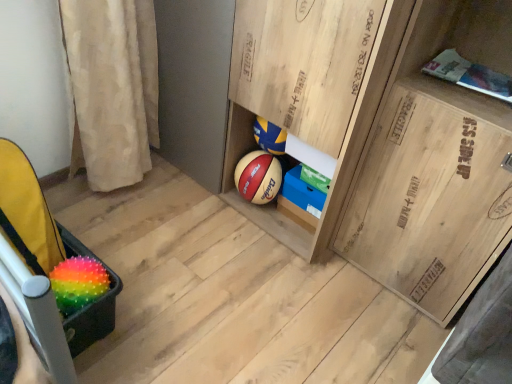
Question: Considering their positions, is rainbow spiky ball at lower left located in front of or behind blue cardboard box at center, acting as the second cabinetry starting from the left?

Choices:
 (A) behind
 (B) front

Answer: (B)

Question: From the image's perspective, relative to blue cardboard box at center, which is the 2th cabinetry in right-to-left order, is rainbow spiky ball at lower left above or below?

Choices:
 (A) above
 (B) below

Answer: (B)

Question: Estimate the real-world distances between objects in this image. Which object is closer to the wooden crate at right, the third cabinetry from the left?

Choices:
 (A) rainbow spiky ball at lower left
 (B) rainbow spiky ball at lower left
 (C) blue cardboard box at center, acting as the second cabinetry starting from the left
 (D) wooden cabinet at center, placed as the third cabinetry when sorted from right to left

Answer: (D)

Question: Considering the real-world distances, which object is closest to the blue cardboard box at center, acting as the second cabinetry starting from the left?

Choices:
 (A) wooden cabinet at center, the 1th cabinetry viewed from the left
 (B) rainbow spiky ball at lower left
 (C) wooden crate at right, the third cabinetry from the left
 (D) rainbow spiky ball at lower left

Answer: (A)